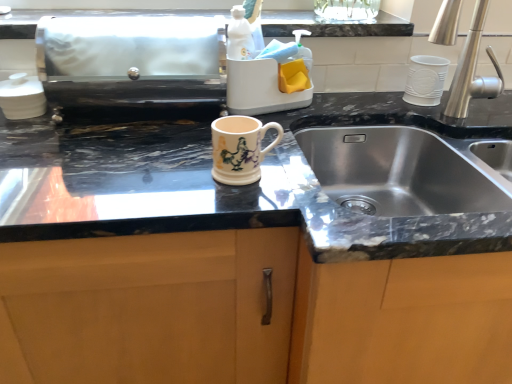
Question: Is silver metallic faucet at right surrounding matte ceramic mug at center?

Choices:
 (A) no
 (B) yes

Answer: (A)

Question: Is silver metallic faucet at right bigger than matte ceramic mug at center?

Choices:
 (A) yes
 (B) no

Answer: (A)

Question: Can you confirm if silver metallic faucet at right is positioned to the right of matte ceramic mug at center?

Choices:
 (A) no
 (B) yes

Answer: (B)

Question: From a real-world perspective, is silver metallic faucet at right physically below matte ceramic mug at center?

Choices:
 (A) no
 (B) yes

Answer: (A)

Question: Is silver metallic faucet at right thinner than matte ceramic mug at center?

Choices:
 (A) yes
 (B) no

Answer: (B)

Question: Is silver metallic faucet at right turned away from matte ceramic mug at center?

Choices:
 (A) yes
 (B) no

Answer: (B)

Question: From a real-world perspective, is matte ceramic mug at center under silver metallic faucet at right?

Choices:
 (A) no
 (B) yes

Answer: (B)

Question: Does matte ceramic mug at center have a larger size compared to silver metallic faucet at right?

Choices:
 (A) yes
 (B) no

Answer: (B)

Question: Considering the relative positions of matte ceramic mug at center and silver metallic faucet at right in the image provided, is matte ceramic mug at center in front of silver metallic faucet at right?

Choices:
 (A) yes
 (B) no

Answer: (A)

Question: Does matte ceramic mug at center have a lesser height compared to silver metallic faucet at right?

Choices:
 (A) yes
 (B) no

Answer: (A)

Question: Is silver metallic faucet at right at the back of matte ceramic mug at center?

Choices:
 (A) no
 (B) yes

Answer: (A)

Question: From a real-world perspective, is matte ceramic mug at center on top of silver metallic faucet at right?

Choices:
 (A) yes
 (B) no

Answer: (B)

Question: Is white glossy sink at upper center facing away from matte ceramic mug at center?

Choices:
 (A) no
 (B) yes

Answer: (A)